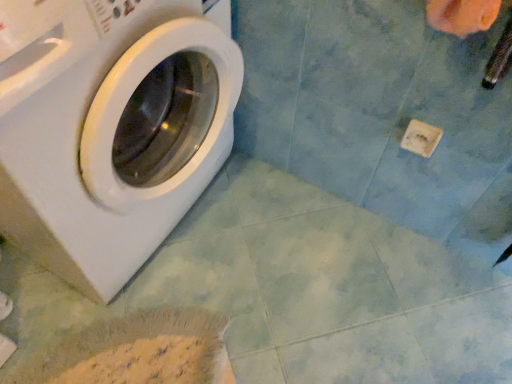
You are a GUI agent. You are given a task and a screenshot of the screen. Output one action in this format:
    pyautogui.click(x=<x>, y=<y>)
    Task: Click on the white glossy washing machine at left
    Image resolution: width=512 pixels, height=384 pixels.
    Given the screenshot: What is the action you would take?
    pyautogui.click(x=110, y=128)

What do you see at coordinates (110, 128) in the screenshot?
I see `white glossy washing machine at left` at bounding box center [110, 128].

What are the coordinates of `white glossy washing machine at left` in the screenshot? It's located at (110, 128).